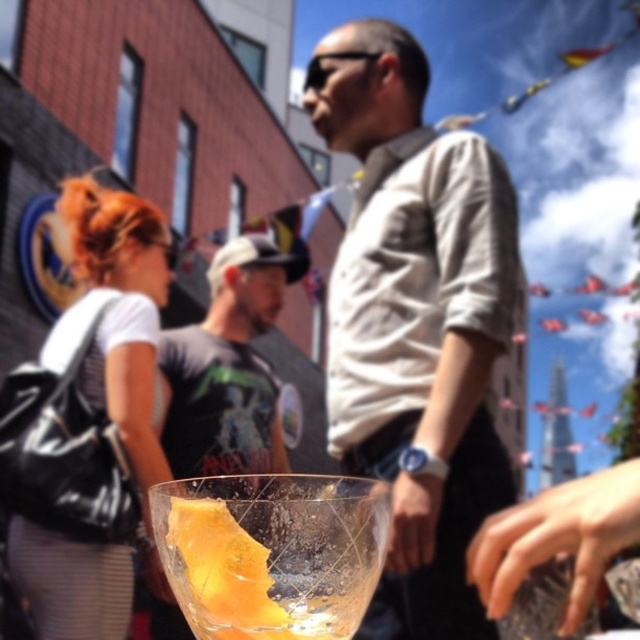
You are observing the scene and want to know which of the two points, point (397, 636) or point (109, 609), is closer to you. Based on the description, which one is nearer?

Point (397, 636) is further to the viewer than point (109, 609), so the point closer to you is point (109, 609).